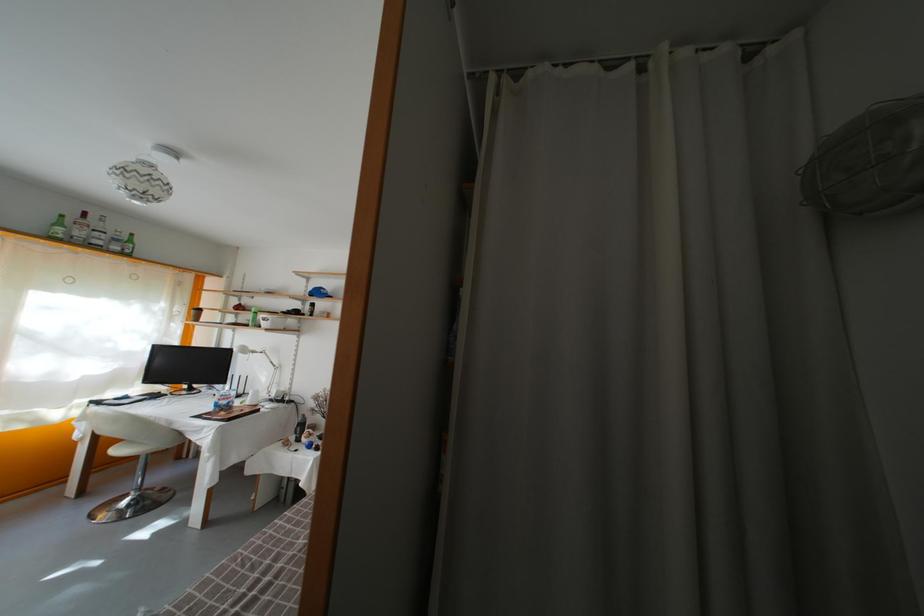
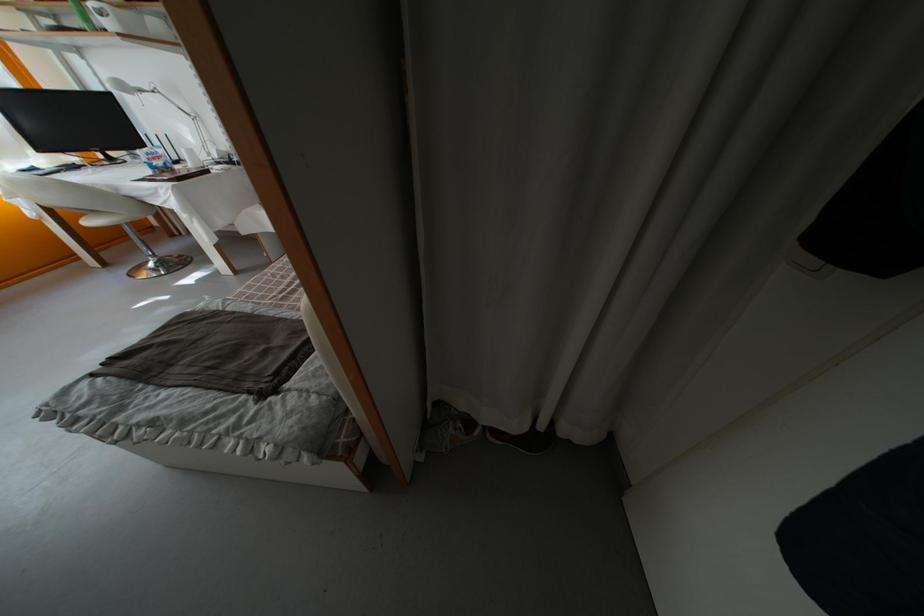
Where in the second image is the point corresponding to point (232, 403) from the first image?

(160, 161)